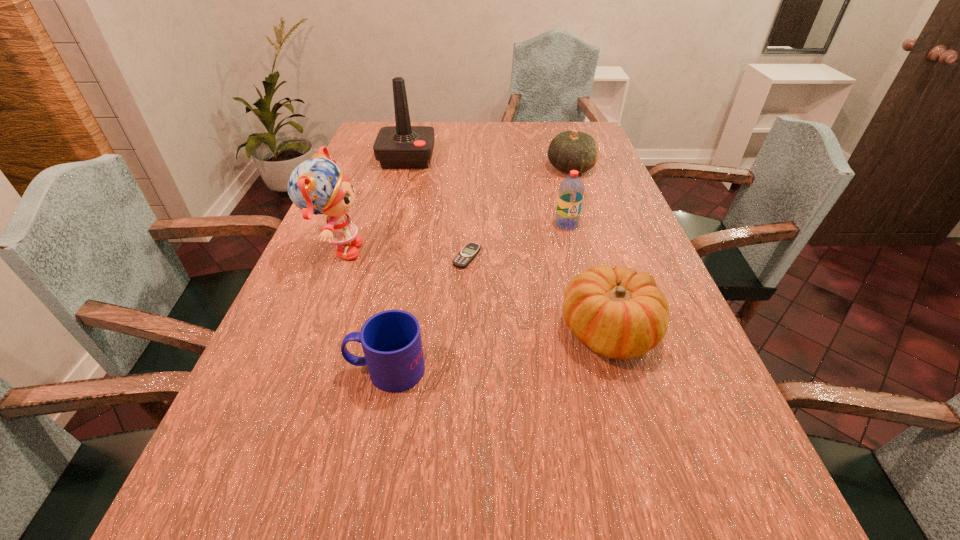
Identify the location of object located in the far left corner section of the desktop. (403, 146).

Where is `free space at the far edge of the desktop`? free space at the far edge of the desktop is located at coordinates (468, 133).

The image size is (960, 540). What are the coordinates of `free space at the left edge of the desktop` in the screenshot? It's located at (364, 234).

Image resolution: width=960 pixels, height=540 pixels. In the image, there is a desktop. In order to click on free space at the right edge in this screenshot , I will do `click(581, 177)`.

Find the location of a particular element. The width and height of the screenshot is (960, 540). free region at the far left corner of the desktop is located at coordinates click(x=365, y=137).

Where is `empty space between the shortest object and the farther gourd`? The image size is (960, 540). empty space between the shortest object and the farther gourd is located at coordinates (519, 213).

The height and width of the screenshot is (540, 960). I want to click on unoccupied position between the joystick and the doll, so click(x=372, y=205).

Find the location of a particular element. This screenshot has width=960, height=540. free space that is in between the mug and the joystick is located at coordinates (396, 264).

The image size is (960, 540). In order to click on vacant area that lies between the doll and the fourth object from left to right in this screenshot , I will do `click(402, 254)`.

Where is `free space between the joystick and the mug`? This screenshot has height=540, width=960. free space between the joystick and the mug is located at coordinates (396, 264).